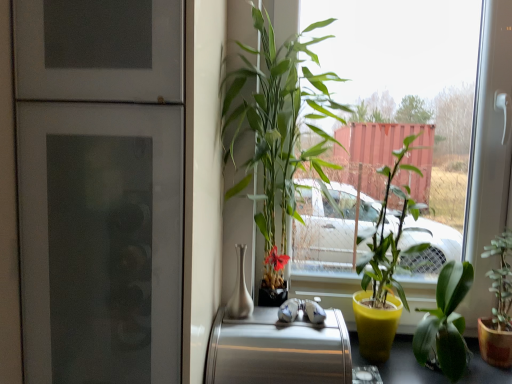
Question: From a real-world perspective, is green glossy plant at center, the fourth houseplant from the right, below green matte plant at lower right, which is the first houseplant in right-to-left order?

Choices:
 (A) yes
 (B) no

Answer: (B)

Question: Does green glossy plant at center, the fourth houseplant from the right, have a lesser height compared to green matte plant at lower right, acting as the fourth houseplant starting from the left?

Choices:
 (A) yes
 (B) no

Answer: (B)

Question: Is the position of green glossy plant at center, positioned as the 1th houseplant in left-to-right order, more distant than that of green matte plant at lower right, acting as the fourth houseplant starting from the left?

Choices:
 (A) yes
 (B) no

Answer: (B)

Question: Could you tell me if green glossy plant at center, positioned as the 1th houseplant in left-to-right order, is facing green matte plant at lower right, acting as the fourth houseplant starting from the left?

Choices:
 (A) no
 (B) yes

Answer: (A)

Question: Does green glossy plant at center, the fourth houseplant from the right, lie in front of green matte plant at lower right, which is the first houseplant in right-to-left order?

Choices:
 (A) no
 (B) yes

Answer: (B)

Question: Is green glossy plant at center, the fourth houseplant from the right, positioned with its back to green matte plant at lower right, which is the first houseplant in right-to-left order?

Choices:
 (A) no
 (B) yes

Answer: (A)

Question: Considering the relative sizes of yellow matte pot at center, positioned as the second houseplant in left-to-right order, and green leafy plant at center in the image provided, is yellow matte pot at center, positioned as the second houseplant in left-to-right order, smaller than green leafy plant at center?

Choices:
 (A) no
 (B) yes

Answer: (B)

Question: Does yellow matte pot at center, acting as the third houseplant starting from the right, come behind green leafy plant at center?

Choices:
 (A) no
 (B) yes

Answer: (B)

Question: Could you tell me if yellow matte pot at center, acting as the third houseplant starting from the right, is turned towards green leafy plant at center?

Choices:
 (A) yes
 (B) no

Answer: (A)

Question: Is yellow matte pot at center, positioned as the second houseplant in left-to-right order, oriented away from green leafy plant at center?

Choices:
 (A) yes
 (B) no

Answer: (A)

Question: From a real-world perspective, is yellow matte pot at center, positioned as the second houseplant in left-to-right order, positioned over green leafy plant at center based on gravity?

Choices:
 (A) no
 (B) yes

Answer: (A)

Question: From the image's perspective, is yellow matte pot at center, acting as the third houseplant starting from the right, above green leafy plant at center?

Choices:
 (A) yes
 (B) no

Answer: (B)

Question: Can green glossy plant at center, the fourth houseplant from the right, be found inside smooth black table at lower right?

Choices:
 (A) no
 (B) yes

Answer: (A)